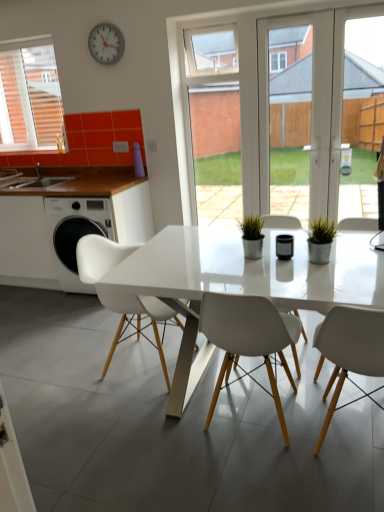
What is the approximate height of transparent glass door at center?

It is 5.22 feet.

Describe the element at coordinates (312, 100) in the screenshot. This screenshot has width=384, height=512. I see `transparent glass door at center` at that location.

What do you see at coordinates (139, 321) in the screenshot?
I see `white matte chair at left, positioned as the 1th chair in left-to-right order` at bounding box center [139, 321].

The height and width of the screenshot is (512, 384). Describe the element at coordinates (321, 240) in the screenshot. I see `green matte plant at right` at that location.

At what (x,y) coordinates should I click in order to perform the action: click on white glossy table at center. Please return your answer as a coordinate pair (x, y). This screenshot has width=384, height=512. Looking at the image, I should click on (242, 283).

What do you see at coordinates (242, 283) in the screenshot? Image resolution: width=384 pixels, height=512 pixels. I see `white glossy table at center` at bounding box center [242, 283].

The width and height of the screenshot is (384, 512). What do you see at coordinates (350, 352) in the screenshot? I see `white matte chair at center, the third chair in the left-to-right sequence` at bounding box center [350, 352].

This screenshot has height=512, width=384. I want to click on transparent glass door at center, so click(312, 100).

From a real-world perspective, count 3rd chairs downward from the transparent glass door at center and point to it. Please provide its 2D coordinates.

[(350, 352)]

Is transparent glass door at center directly adjacent to white matte chair at center, which is counted as the first chair, starting from the right?

No, transparent glass door at center is not in contact with white matte chair at center, which is counted as the first chair, starting from the right.

Is point (320, 203) closer or farther from the camera than point (378, 347)?

Clearly, point (320, 203) is more distant from the camera than point (378, 347).

Can you confirm if transparent glass door at center is positioned to the right of white matte chair at center, the third chair in the left-to-right sequence?

Yes.

Is white glossy table at center inside white glossy sink at left?

No.

Does white glossy sink at left turn towards white glossy table at center?

No, white glossy sink at left is not aimed at white glossy table at center.

Does white glossy sink at left have a larger size compared to white glossy table at center?

No, white glossy sink at left is not bigger than white glossy table at center.

Is white glossy sink at left to the left or to the right of white glossy table at center in the image?

From the image, it's evident that white glossy sink at left is to the left of white glossy table at center.

From a real-world perspective, is transparent glass door at center positioned above or below metallic gray clock at upper center?

transparent glass door at center is below metallic gray clock at upper center.

From the image's perspective, relative to metallic gray clock at upper center, is transparent glass door at center above or below?

Based on their image positions, transparent glass door at center is located beneath metallic gray clock at upper center.

Does transparent glass door at center have a greater width compared to metallic gray clock at upper center?

Yes, transparent glass door at center is wider than metallic gray clock at upper center.

From a real-world perspective, is white glossy sink at left above or below white matte chair at left, positioned as the 1th chair in left-to-right order?

Clearly, from a real-world perspective, white glossy sink at left is above white matte chair at left, positioned as the 1th chair in left-to-right order.

From the image's perspective, between white glossy sink at left and white matte chair at left, which is the third chair in right-to-left order, which one is located above?

From the image's view, white glossy sink at left is above.

Which object is thinner, white glossy sink at left or white matte chair at left, which is the third chair in right-to-left order?

white glossy sink at left.

From a real-world perspective, is metallic gray clock at upper center positioned under transparent glass door at center based on gravity?

Actually, metallic gray clock at upper center is physically above transparent glass door at center in the real world.

From the image's perspective, would you say metallic gray clock at upper center is shown under transparent glass door at center?

Actually, metallic gray clock at upper center appears above transparent glass door at center in the image.

Measure the distance between metallic gray clock at upper center and transparent glass door at center.

The distance of metallic gray clock at upper center from transparent glass door at center is 4.52 feet.

Considering the relative sizes of metallic gray clock at upper center and transparent glass door at center in the image provided, is metallic gray clock at upper center thinner than transparent glass door at center?

Yes, metallic gray clock at upper center is thinner than transparent glass door at center.

From the image's perspective, is white matte chair at center, the third chair in the left-to-right sequence, over white glossy table at center?

Incorrect, from the image's perspective, white matte chair at center, the third chair in the left-to-right sequence, is lower than white glossy table at center.

Is white matte chair at center, the third chair in the left-to-right sequence, beside white glossy table at center?

No, white matte chair at center, the third chair in the left-to-right sequence, is not next to white glossy table at center.

Is white matte chair at center, which is counted as the first chair, starting from the right, not inside white glossy table at center?

No, white matte chair at center, which is counted as the first chair, starting from the right, is inside white glossy table at center's boundary.

Is white matte chair at center, which is counted as the first chair, starting from the right, wider or thinner than white glossy table at center?

In the image, white matte chair at center, which is counted as the first chair, starting from the right, appears to be more narrow than white glossy table at center.

From the image's perspective, would you say green matte plant at right is shown under white glossy sink at left?

Yes.

Find the location of `houseplant on the right of white glossy sink at left`. houseplant on the right of white glossy sink at left is located at coordinates (321, 240).

Is green matte plant at right beside white glossy sink at left?

No, green matte plant at right is not with white glossy sink at left.

Is green matte plant at right not within white glossy sink at left?

Yes, green matte plant at right is outside of white glossy sink at left.

The width and height of the screenshot is (384, 512). Identify the location of screen door above the white matte chair at center, the third chair in the left-to-right sequence (from the image's perspective). (312, 100).

Identify the location of kitchen & dining room table below the white glossy sink at left (from a real-world perspective). This screenshot has width=384, height=512. (242, 283).

Estimate the real-world distances between objects in this image. Which object is closer to white matte chair at center, the third chair in the left-to-right sequence, white glossy sink at left or metallic gray clock at upper center?

white glossy sink at left.

When comparing their distances from metallic gray clock at upper center, does white plastic chair at left or white matte chair at center, which is counted as the first chair, starting from the right, seem further?

The object further to metallic gray clock at upper center is white matte chair at center, which is counted as the first chair, starting from the right.

Looking at the image, which one is located closer to white matte chair at left, which is the third chair in right-to-left order, green matte plant at right or white matte chair at center, which is counted as the first chair, starting from the right?

white matte chair at center, which is counted as the first chair, starting from the right, lies closer to white matte chair at left, which is the third chair in right-to-left order, than the other object.

Looking at this image, considering their positions, is white plastic chair at left positioned closer to green matte plant at right than transparent glass door at center?

transparent glass door at center.

Based on the photo, based on their spatial positions, is white glossy sink at left or white plastic chair at left further from white matte chair at center, the second chair when ordered from left to right?

white glossy sink at left.

From the picture: Looking at the image, which one is located closer to white matte chair at center, the second chair when ordered from left to right, white glossy table at center or white matte chair at center, the third chair in the left-to-right sequence?

white matte chair at center, the third chair in the left-to-right sequence, lies closer to white matte chair at center, the second chair when ordered from left to right, than the other object.

Estimate the real-world distances between objects in this image. Which object is closer to white glossy sink at left, white plastic chair at left or white matte chair at left, positioned as the 1th chair in left-to-right order?

white plastic chair at left is closer to white glossy sink at left.

Based on the photo, looking at the image, which one is located further to black glossy pen holder at center, white matte chair at left, which is the third chair in right-to-left order, or white glossy sink at left?

white glossy sink at left.

Find the location of `kitchen & dining room table located between white matte chair at center, the third chair in the left-to-right sequence, and transparent glass door at center in the depth direction`. kitchen & dining room table located between white matte chair at center, the third chair in the left-to-right sequence, and transparent glass door at center in the depth direction is located at coordinates (242, 283).

Find the location of a particular element. This screenshot has height=512, width=384. houseplant between white glossy sink at left and transparent glass door at center in the horizontal direction is located at coordinates (321, 240).

I want to click on houseplant between white plastic chair at left and transparent glass door at center in the horizontal direction, so click(x=321, y=240).

Identify the location of chair located between black glossy pen holder at center and white plastic chair at left in the depth direction. The height and width of the screenshot is (512, 384). (139, 321).